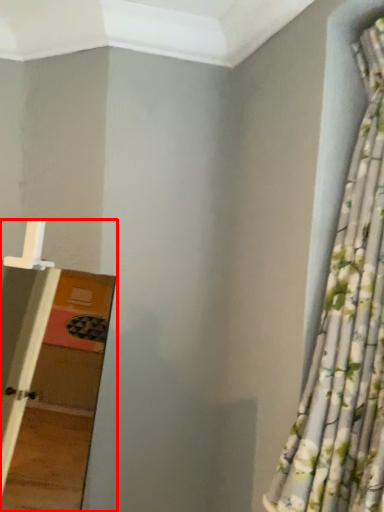
Question: From the image, what is the correct spatial relationship of ladder (annotated by the red box) in relation to curtain?

Choices:
 (A) right
 (B) left

Answer: (B)